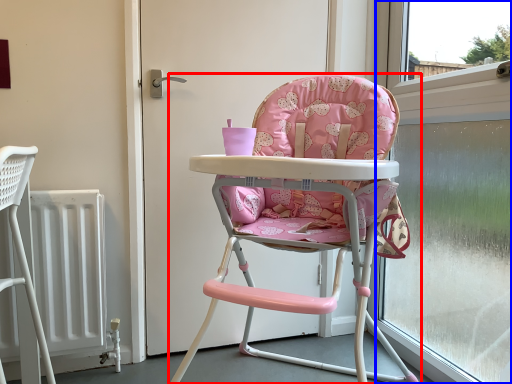
Question: Which point is further to the camera, chair (highlighted by a red box) or window screen (highlighted by a blue box)?

Choices:
 (A) chair
 (B) window screen

Answer: (B)